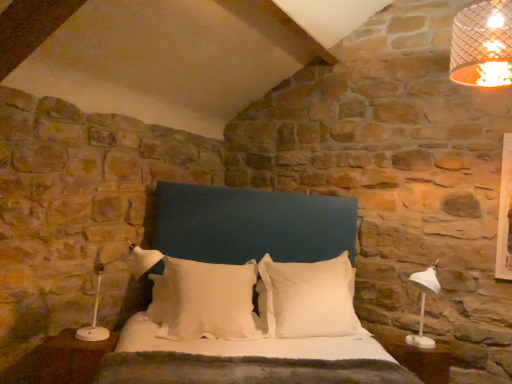
Question: Considering the relative positions of white plastic lamp at left and brown wood nightstand at lower left in the image provided, is white plastic lamp at left to the left or to the right of brown wood nightstand at lower left?

Choices:
 (A) right
 (B) left

Answer: (A)

Question: Is white plastic lamp at left spatially inside brown wood nightstand at lower left, or outside of it?

Choices:
 (A) inside
 (B) outside

Answer: (B)

Question: Which object is the farthest from the white plastic side table at lower right?

Choices:
 (A) white soft pillow at center, marked as the 1th pillow in a right-to-left arrangement
 (B) white soft pillow at center, which ranks as the first pillow in left-to-right order
 (C) white plastic lamp at left
 (D) brown wood nightstand at lower left

Answer: (C)

Question: Which is farther from the white plastic lamp at left?

Choices:
 (A) white soft pillow at center, the 2th pillow positioned from the left
 (B) white plastic side table at lower right
 (C) white soft pillow at center, which ranks as the first pillow in left-to-right order
 (D) brown wood nightstand at lower left

Answer: (B)